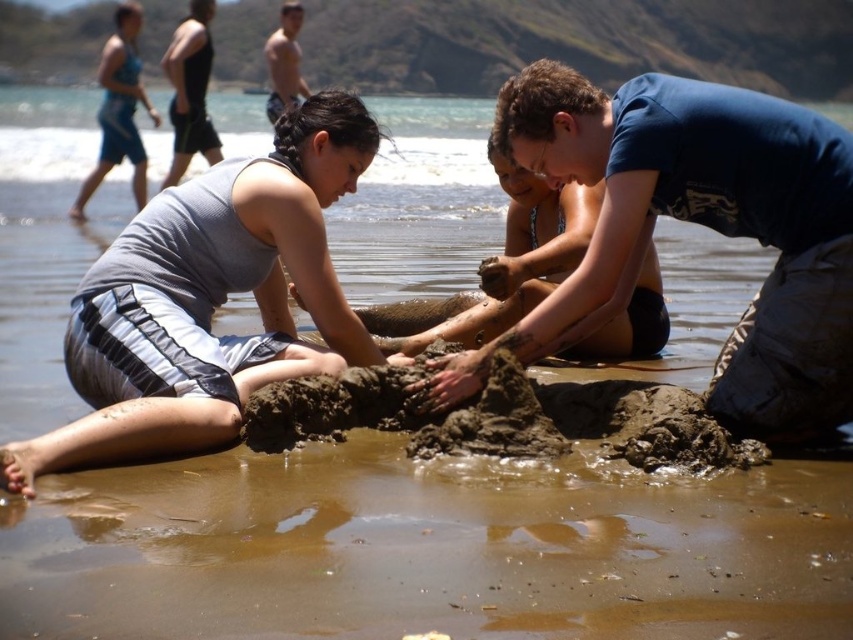
Which is below, blue cotton shirt at upper right or black tank top at upper left?

Positioned lower is blue cotton shirt at upper right.

Who is shorter, blue cotton shirt at upper right or black tank top at upper left?

With less height is blue cotton shirt at upper right.

This screenshot has width=853, height=640. Describe the element at coordinates (699, 224) in the screenshot. I see `blue cotton shirt at upper right` at that location.

You are a GUI agent. You are given a task and a screenshot of the screen. Output one action in this format:
    pyautogui.click(x=<x>, y=<y>)
    Task: Click on the blue cotton shirt at upper right
    The width and height of the screenshot is (853, 640).
    Given the screenshot: What is the action you would take?
    pyautogui.click(x=699, y=224)

Does blue cotton shirt at upper right have a larger size compared to blue fabric swimsuit at upper left?

Actually, blue cotton shirt at upper right might be smaller than blue fabric swimsuit at upper left.

Who is lower down, blue cotton shirt at upper right or blue fabric swimsuit at upper left?

blue cotton shirt at upper right

Find the location of a particular element. This screenshot has height=640, width=853. blue cotton shirt at upper right is located at coordinates (699, 224).

Is black tank top at upper left behind skinny man at upper center?

No.

In the scene shown: Is black tank top at upper left bigger than skinny man at upper center?

Correct, black tank top at upper left is larger in size than skinny man at upper center.

Between point (204, 4) and point (282, 92), which one is positioned in front?

Point (204, 4)

Identify the location of black tank top at upper left. This screenshot has width=853, height=640. (190, 90).